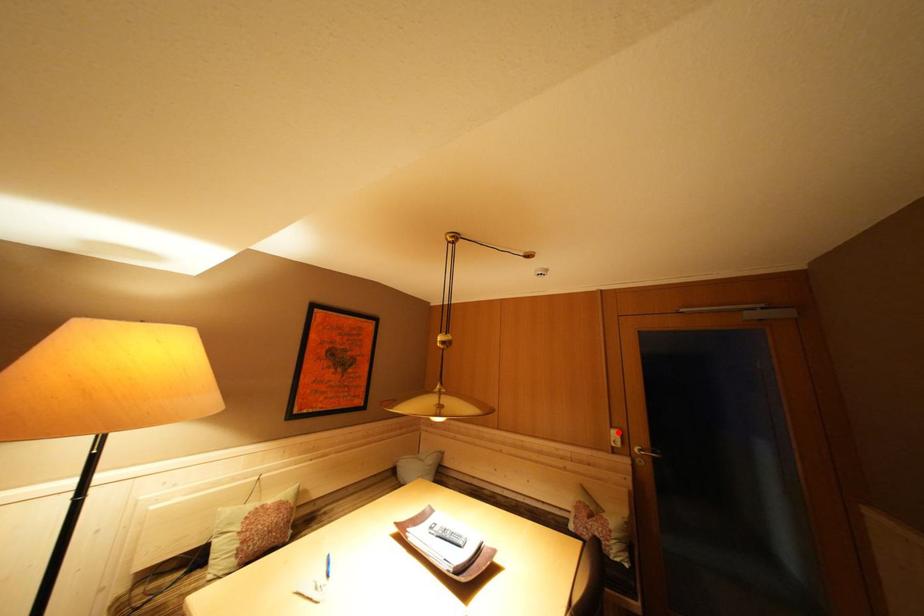
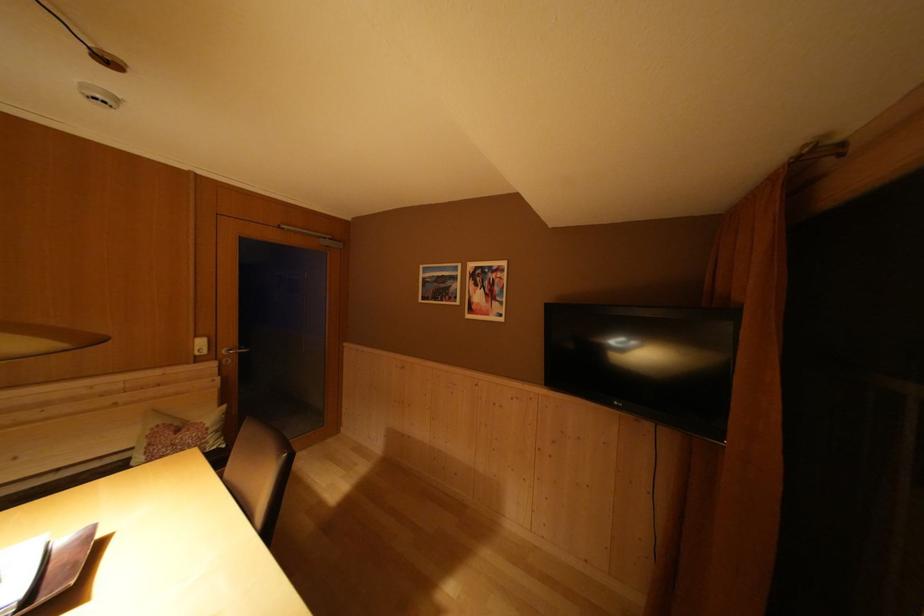
Locate, in the second image, the point that corresponds to the highlighted location in the first image.

(203, 342)